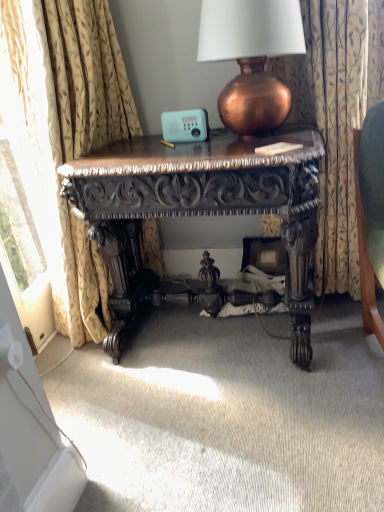
Find the location of `floral fabric curtain at right, which is the first curtain from right to left`. floral fabric curtain at right, which is the first curtain from right to left is located at coordinates (336, 118).

The image size is (384, 512). Describe the element at coordinates (69, 130) in the screenshot. I see `gold floral fabric curtain at left, the 2th curtain from the right` at that location.

Where is `copper metallic lamp at upper center`? This screenshot has width=384, height=512. copper metallic lamp at upper center is located at coordinates (251, 57).

From a real-world perspective, who is located higher, gold floral fabric curtain at left, the 2th curtain from the right, or copper metallic lamp at upper center?

From a 3D spatial view, copper metallic lamp at upper center is above.

How distant is gold floral fabric curtain at left, the 2th curtain from the right, from copper metallic lamp at upper center?

gold floral fabric curtain at left, the 2th curtain from the right, and copper metallic lamp at upper center are 23.57 inches apart from each other.

Does gold floral fabric curtain at left, which is the first curtain in left-to-right order, have a larger size compared to copper metallic lamp at upper center?

Indeed, gold floral fabric curtain at left, which is the first curtain in left-to-right order, has a larger size compared to copper metallic lamp at upper center.

Between gold floral fabric curtain at left, which is the first curtain in left-to-right order, and copper metallic lamp at upper center, which one appears on the right side from the viewer's perspective?

copper metallic lamp at upper center is more to the right.

Between floral fabric curtain at right, which is the first curtain from right to left, and copper metallic lamp at upper center, which one has more height?

floral fabric curtain at right, which is the first curtain from right to left.

Considering the positions of points (327, 103) and (259, 74), is point (327, 103) farther from camera compared to point (259, 74)?

Yes, it is behind point (259, 74).

Is floral fabric curtain at right, which is the first curtain from right to left, not close to copper metallic lamp at upper center?

floral fabric curtain at right, which is the first curtain from right to left, is near copper metallic lamp at upper center, not far away.

From the picture: Is floral fabric curtain at right, which is the first curtain from right to left, outside of copper metallic lamp at upper center?

→ floral fabric curtain at right, which is the first curtain from right to left, is positioned outside copper metallic lamp at upper center.

Looking at their sizes, would you say polished dark wood desk at center is wider or thinner than gold floral fabric curtain at left, which is the first curtain in left-to-right order?

Considering their sizes, polished dark wood desk at center looks broader than gold floral fabric curtain at left, which is the first curtain in left-to-right order.

From a real-world perspective, relative to gold floral fabric curtain at left, which is the first curtain in left-to-right order, is polished dark wood desk at center vertically above or below?

Clearly, from a real-world perspective, polished dark wood desk at center is below gold floral fabric curtain at left, which is the first curtain in left-to-right order.

What's the angular difference between polished dark wood desk at center and gold floral fabric curtain at left, the 2th curtain from the right,'s facing directions?

There is a 91.2-degree angle between the facing directions of polished dark wood desk at center and gold floral fabric curtain at left, the 2th curtain from the right.

Is polished dark wood desk at center in contact with gold floral fabric curtain at left, which is the first curtain in left-to-right order?

They are not placed beside each other.

Looking at this image, is gold floral fabric curtain at left, the 2th curtain from the right, turned away from floral fabric curtain at right, the 2th curtain in the left-to-right sequence?

No, gold floral fabric curtain at left, the 2th curtain from the right,'s orientation is not away from floral fabric curtain at right, the 2th curtain in the left-to-right sequence.

In the scene shown: How different are the orientations of gold floral fabric curtain at left, which is the first curtain in left-to-right order, and floral fabric curtain at right, which is the first curtain from right to left, in degrees?

There is a 85.1-degree angle between the facing directions of gold floral fabric curtain at left, which is the first curtain in left-to-right order, and floral fabric curtain at right, which is the first curtain from right to left.

From the picture: Considering the sizes of objects gold floral fabric curtain at left, which is the first curtain in left-to-right order, and floral fabric curtain at right, the 2th curtain in the left-to-right sequence, in the image provided, who is wider, gold floral fabric curtain at left, which is the first curtain in left-to-right order, or floral fabric curtain at right, the 2th curtain in the left-to-right sequence,?

Wider between the two is gold floral fabric curtain at left, which is the first curtain in left-to-right order.

From the image's perspective, which is above, polished dark wood desk at center or floral fabric curtain at right, the 2th curtain in the left-to-right sequence?

floral fabric curtain at right, the 2th curtain in the left-to-right sequence.

How many degrees apart are the facing directions of polished dark wood desk at center and floral fabric curtain at right, which is the first curtain from right to left?

The angle between the facing direction of polished dark wood desk at center and the facing direction of floral fabric curtain at right, which is the first curtain from right to left, is 6.05 degrees.

Based on their positions, is polished dark wood desk at center located to the left or right of floral fabric curtain at right, which is the first curtain from right to left?

Clearly, polished dark wood desk at center is on the left of floral fabric curtain at right, which is the first curtain from right to left, in the image.

From a real-world perspective, which object rests below the other?

polished dark wood desk at center is physically lower.

Considering the relative sizes of copper metallic lamp at upper center and floral fabric curtain at right, which is the first curtain from right to left, in the image provided, is copper metallic lamp at upper center wider than floral fabric curtain at right, which is the first curtain from right to left,?

Indeed, copper metallic lamp at upper center has a greater width compared to floral fabric curtain at right, which is the first curtain from right to left.

Would you consider copper metallic lamp at upper center to be distant from floral fabric curtain at right, the 2th curtain in the left-to-right sequence?

A: That's not correct — copper metallic lamp at upper center is a little close to floral fabric curtain at right, the 2th curtain in the left-to-right sequence.

At what (x,y) coordinates should I click in order to perform the action: click on lamp above the floral fabric curtain at right, which is the first curtain from right to left (from the image's perspective). Please return your answer as a coordinate pair (x, y). This screenshot has height=512, width=384. Looking at the image, I should click on 251,57.

Is copper metallic lamp at upper center inside or outside of gold floral fabric curtain at left, the 2th curtain from the right?

copper metallic lamp at upper center is not enclosed by gold floral fabric curtain at left, the 2th curtain from the right.

Based on the photo, is copper metallic lamp at upper center turned away from gold floral fabric curtain at left, which is the first curtain in left-to-right order?

No, copper metallic lamp at upper center is not facing away from gold floral fabric curtain at left, which is the first curtain in left-to-right order.

Which is more to the right, copper metallic lamp at upper center or gold floral fabric curtain at left, which is the first curtain in left-to-right order?

copper metallic lamp at upper center.

Are copper metallic lamp at upper center and gold floral fabric curtain at left, which is the first curtain in left-to-right order, beside each other?

No.

This screenshot has width=384, height=512. I want to click on curtain lying on the left of copper metallic lamp at upper center, so click(69, 130).

Where is `the 2nd curtain positioned below the copper metallic lamp at upper center (from a real-world perspective)`? The image size is (384, 512). the 2nd curtain positioned below the copper metallic lamp at upper center (from a real-world perspective) is located at coordinates pyautogui.click(x=336, y=118).

Looking at the image, which one is located further to copper metallic lamp at upper center, polished dark wood desk at center or floral fabric curtain at right, which is the first curtain from right to left?

The object further to copper metallic lamp at upper center is polished dark wood desk at center.

Looking at this image, looking at the image, which one is located closer to floral fabric curtain at right, which is the first curtain from right to left, copper metallic lamp at upper center or polished dark wood desk at center?

copper metallic lamp at upper center.

Considering their positions, is copper metallic lamp at upper center positioned further to polished dark wood desk at center than floral fabric curtain at right, which is the first curtain from right to left?

floral fabric curtain at right, which is the first curtain from right to left, lies further to polished dark wood desk at center than the other object.

Looking at the image, which one is located closer to copper metallic lamp at upper center, floral fabric curtain at right, the 2th curtain in the left-to-right sequence, or gold floral fabric curtain at left, which is the first curtain in left-to-right order?

The object closer to copper metallic lamp at upper center is floral fabric curtain at right, the 2th curtain in the left-to-right sequence.

Which object lies further to the anchor point gold floral fabric curtain at left, the 2th curtain from the right, copper metallic lamp at upper center or floral fabric curtain at right, which is the first curtain from right to left?

floral fabric curtain at right, which is the first curtain from right to left, lies further to gold floral fabric curtain at left, the 2th curtain from the right, than the other object.

Considering their positions, is floral fabric curtain at right, which is the first curtain from right to left, positioned further to polished dark wood desk at center than copper metallic lamp at upper center?

The object further to polished dark wood desk at center is floral fabric curtain at right, which is the first curtain from right to left.

Estimate the real-world distances between objects in this image. Which object is further from floral fabric curtain at right, the 2th curtain in the left-to-right sequence, polished dark wood desk at center or copper metallic lamp at upper center?

polished dark wood desk at center is positioned further to the anchor floral fabric curtain at right, the 2th curtain in the left-to-right sequence.

Considering their positions, is floral fabric curtain at right, the 2th curtain in the left-to-right sequence, positioned further to polished dark wood desk at center than gold floral fabric curtain at left, the 2th curtain from the right?

floral fabric curtain at right, the 2th curtain in the left-to-right sequence, is positioned further to the anchor polished dark wood desk at center.

Locate an element on the screen. lamp situated between gold floral fabric curtain at left, which is the first curtain in left-to-right order, and floral fabric curtain at right, the 2th curtain in the left-to-right sequence, from left to right is located at coordinates (251, 57).

The image size is (384, 512). In order to click on desk between gold floral fabric curtain at left, the 2th curtain from the right, and floral fabric curtain at right, which is the first curtain from right to left, in the horizontal direction in this screenshot , I will do pyautogui.click(x=201, y=212).

The height and width of the screenshot is (512, 384). I want to click on desk between gold floral fabric curtain at left, which is the first curtain in left-to-right order, and copper metallic lamp at upper center, so point(201,212).